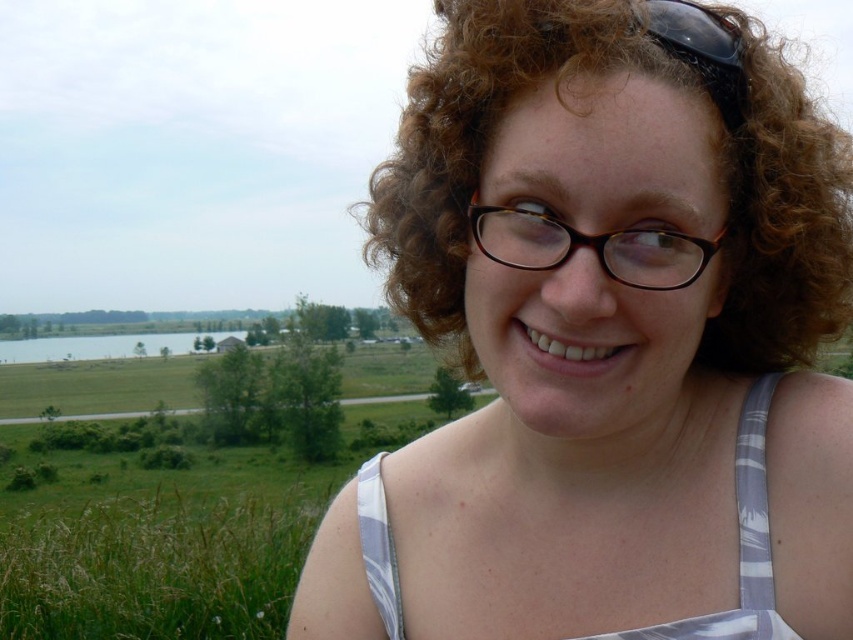
Question: Considering the relative positions of white striped fabric dress at center and black plastic glasses at center in the image provided, where is white striped fabric dress at center located with respect to black plastic glasses at center?

Choices:
 (A) above
 (B) below

Answer: (B)

Question: Among these objects, which one is nearest to the camera?

Choices:
 (A) black plastic glasses at center
 (B) matte white tank top at center

Answer: (B)

Question: Among these objects, which one is nearest to the camera?

Choices:
 (A) white striped fabric dress at center
 (B) black plastic glasses at center
 (C) matte white tank top at center

Answer: (C)

Question: From the image, what is the correct spatial relationship of white striped fabric dress at center in relation to black plastic glasses at center?

Choices:
 (A) left
 (B) right

Answer: (A)

Question: Can you confirm if white striped fabric dress at center is smaller than black plastic glasses at center?

Choices:
 (A) yes
 (B) no

Answer: (B)

Question: Which is farther from the black plastic glasses at center?

Choices:
 (A) matte white tank top at center
 (B) white striped fabric dress at center

Answer: (B)